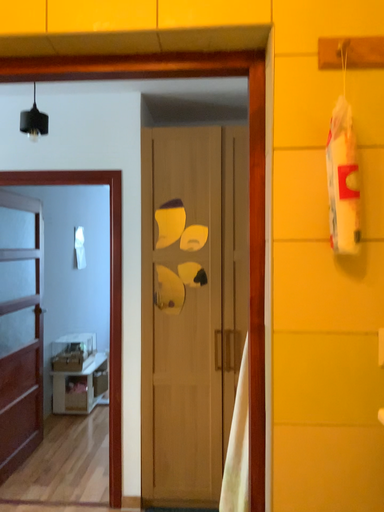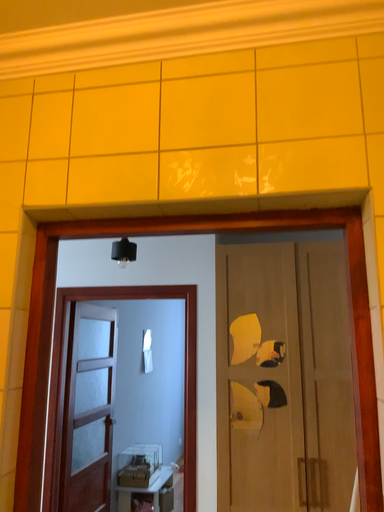
Question: Which way did the camera rotate in the video?

Choices:
 (A) rotated upward
 (B) rotated downward

Answer: (A)